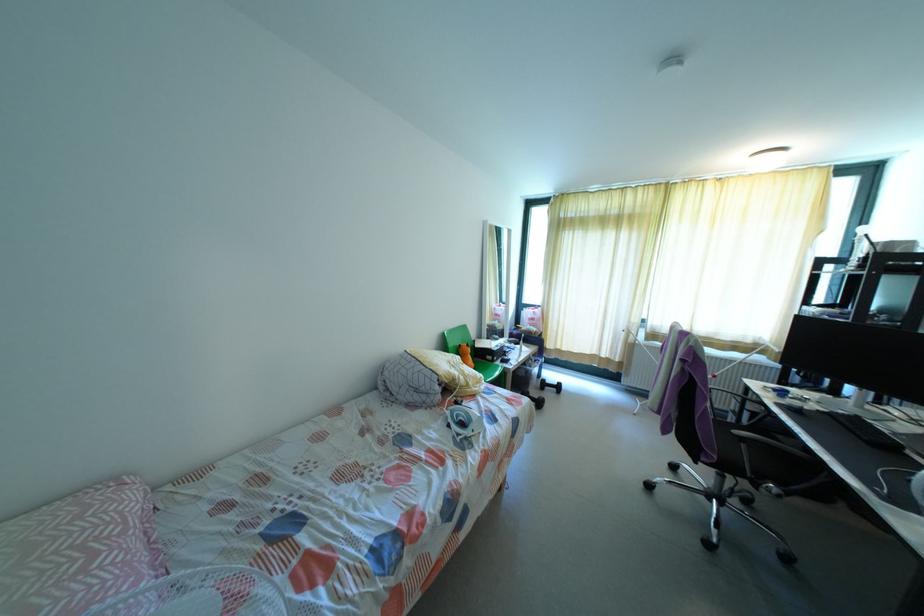
Find the location of `black chair sitting surface`. black chair sitting surface is located at coordinates (749, 440).